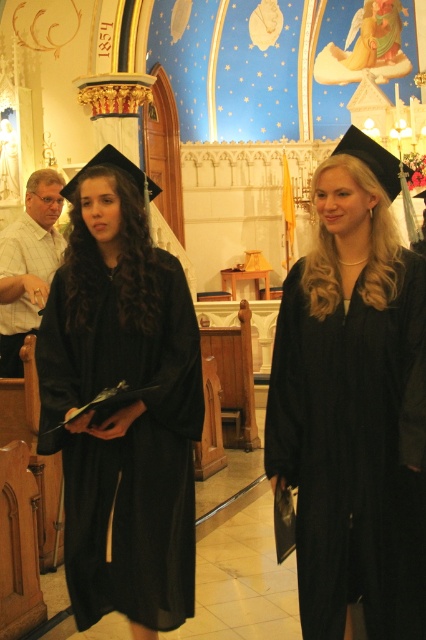
You are a photographer standing at the back of the church during a graduation ceremony. You need to capture a clear photo of both the matte black graduation gown at center and the matte black gown at left. Based on their heights, which gown will appear taller in your photo?

The matte black graduation gown at center will appear taller in the photo because it has a greater height compared to the matte black gown at left.

You are standing in the church and want to hand a document to the person wearing the matte black graduation gown at center. Based on the coordinates provided, in which direction should you walk to reach them?

The matte black graduation gown at center is located at coordinates point (x=354, y=403), so you should walk towards the center of the church to reach them.